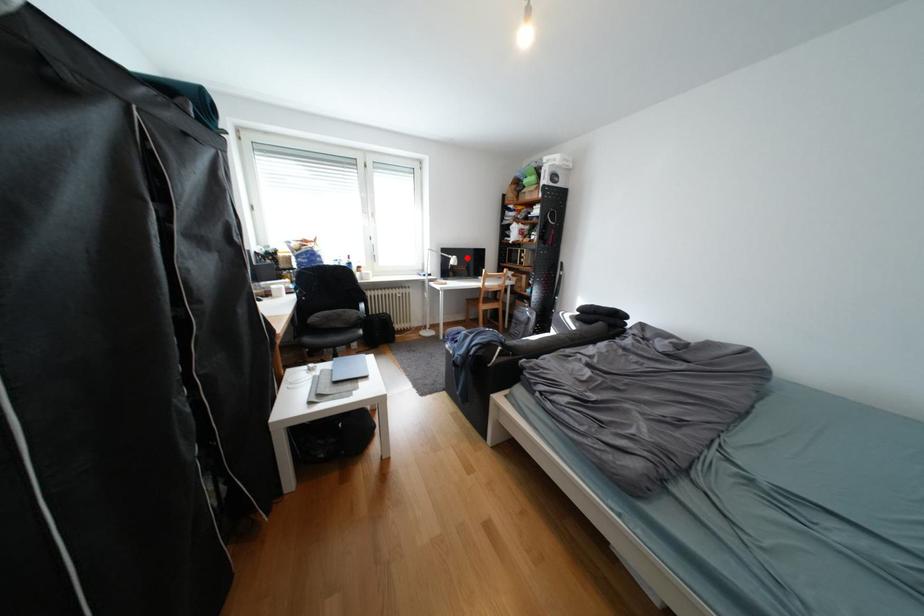
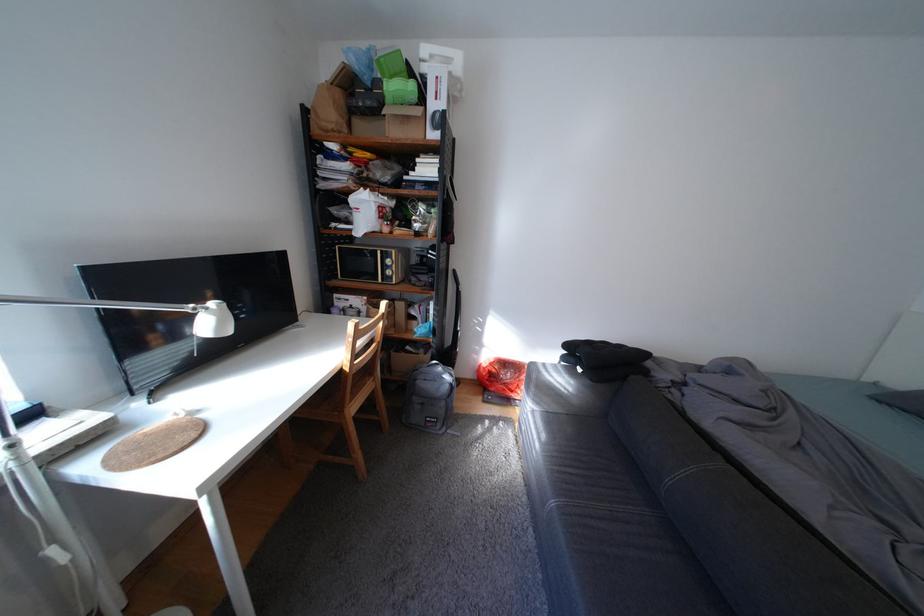
In the second image, find the point that corresponds to the highlighted location in the first image.

(225, 305)